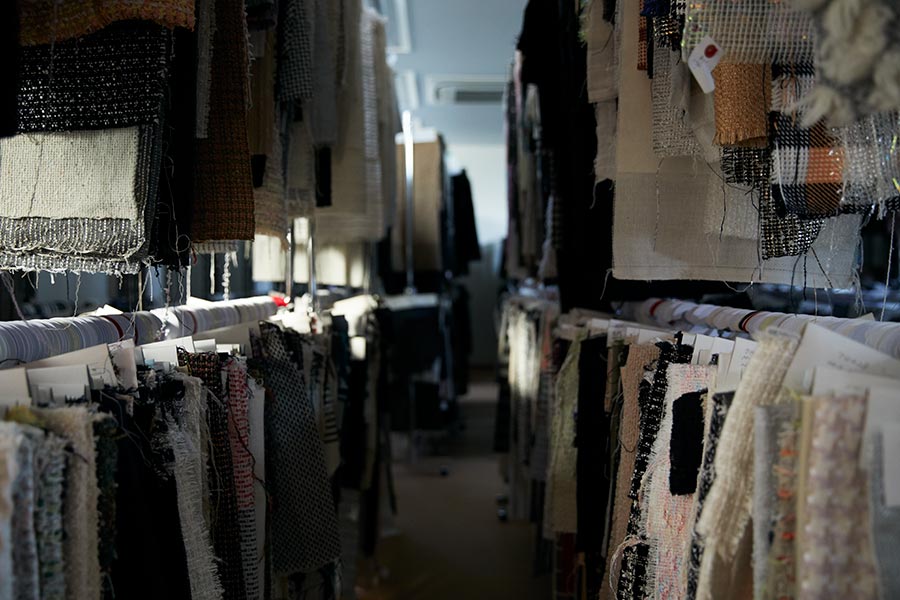
The width and height of the screenshot is (900, 600). I want to click on wall, so [460, 141], [495, 164], [495, 210].